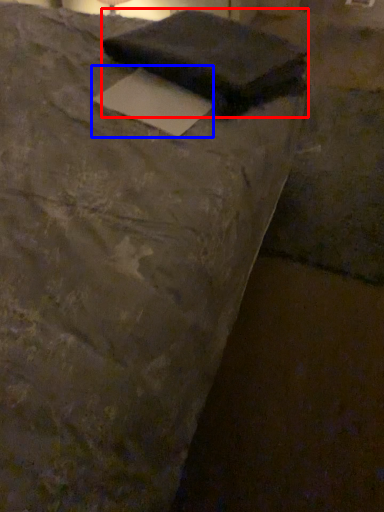
Question: Which of the following is the closest to the observer, writing (highlighted by a red box) or writing (highlighted by a blue box)?

Choices:
 (A) writing
 (B) writing

Answer: (B)